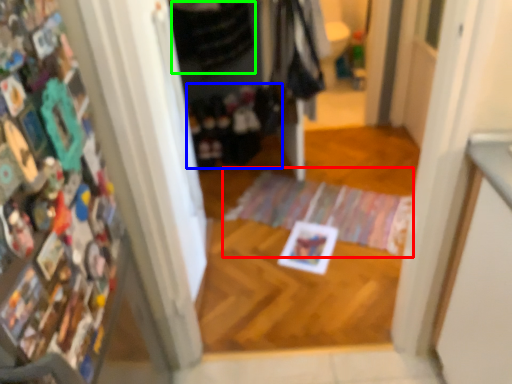
Question: Considering the real-world distances, which object is closest to doormat (highlighted by a red box)? clothing (highlighted by a blue box) or clothing (highlighted by a green box).

Choices:
 (A) clothing
 (B) clothing

Answer: (A)